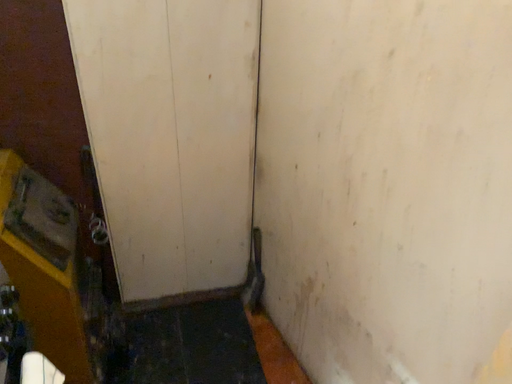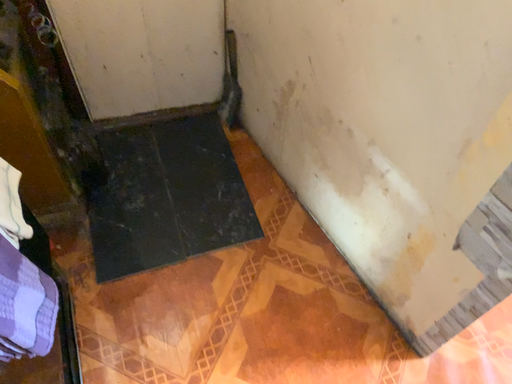
Question: Which way did the camera rotate in the video?

Choices:
 (A) rotated downward
 (B) rotated upward

Answer: (A)